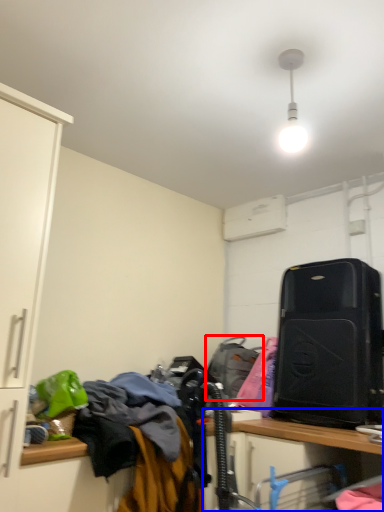
Question: Which point is further to the camera, luggage and bags (highlighted by a red box) or computer desk (highlighted by a blue box)?

Choices:
 (A) luggage and bags
 (B) computer desk

Answer: (A)